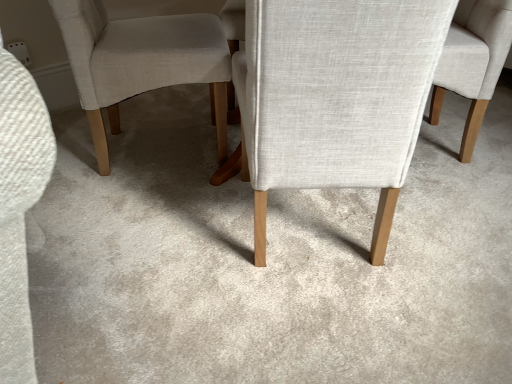
Identify the location of light beige fabric chair at center, which is counted as the 2th chair, starting from the right. This screenshot has width=512, height=384. (336, 96).

What do you see at coordinates (336, 96) in the screenshot?
I see `light beige fabric chair at center, which is counted as the 2th chair, starting from the right` at bounding box center [336, 96].

What do you see at coordinates (473, 62) in the screenshot? I see `light beige fabric chair at center, the first chair viewed from the right` at bounding box center [473, 62].

Identify the location of light beige fabric chair at center, the 2th chair from the left. (473, 62).

You are a GUI agent. You are given a task and a screenshot of the screen. Output one action in this format:
    pyautogui.click(x=<x>, y=<y>)
    Task: Click on the light beige fabric chair at center, positioned as the first chair in left-to-right order
    
    Given the screenshot: What is the action you would take?
    pyautogui.click(x=336, y=96)

Between light beige fabric chair at center, positioned as the first chair in left-to-right order, and light beige fabric chair at center, the first chair viewed from the right, which one appears on the right side from the viewer's perspective?

light beige fabric chair at center, the first chair viewed from the right, is more to the right.

Does light beige fabric chair at center, which is counted as the 2th chair, starting from the right, lie behind light beige fabric chair at center, the 2th chair from the left?

No, light beige fabric chair at center, which is counted as the 2th chair, starting from the right, is closer to the viewer.

Considering the positions of point (301, 82) and point (475, 94), is point (301, 82) closer or farther from the camera than point (475, 94)?

Clearly, point (301, 82) is closer to the camera than point (475, 94).

From the image's perspective, which is below, light beige fabric chair at center, positioned as the first chair in left-to-right order, or light beige fabric chair at center, the 2th chair from the left?

light beige fabric chair at center, positioned as the first chair in left-to-right order, from the image's perspective.

From a real-world perspective, is light beige fabric chair at center, which is counted as the 2th chair, starting from the right, positioned under light beige fabric chair at center, the 2th chair from the left, based on gravity?

Incorrect, from a real-world perspective, light beige fabric chair at center, which is counted as the 2th chair, starting from the right, is higher than light beige fabric chair at center, the 2th chair from the left.

Consider the image. Considering the relative sizes of light beige fabric chair at center, which is counted as the 2th chair, starting from the right, and light beige fabric chair at center, the 2th chair from the left, in the image provided, is light beige fabric chair at center, which is counted as the 2th chair, starting from the right, wider than light beige fabric chair at center, the 2th chair from the left,?

Indeed, light beige fabric chair at center, which is counted as the 2th chair, starting from the right, has a greater width compared to light beige fabric chair at center, the 2th chair from the left.

Considering the sizes of light beige fabric chair at center, which is counted as the 2th chair, starting from the right, and light beige fabric chair at center, the 2th chair from the left, in the image, is light beige fabric chair at center, which is counted as the 2th chair, starting from the right, taller or shorter than light beige fabric chair at center, the 2th chair from the left,?

Considering their sizes, light beige fabric chair at center, which is counted as the 2th chair, starting from the right, has more height than light beige fabric chair at center, the 2th chair from the left.

Between light beige fabric chair at center, which is counted as the 2th chair, starting from the right, and light beige fabric chair at center, the first chair viewed from the right, which one has larger size?

light beige fabric chair at center, which is counted as the 2th chair, starting from the right.

Is light beige fabric chair at center, positioned as the first chair in left-to-right order, inside or outside of light beige fabric chair at center, the first chair viewed from the right?

light beige fabric chair at center, positioned as the first chair in left-to-right order, is outside light beige fabric chair at center, the first chair viewed from the right.

Is light beige fabric chair at center, positioned as the first chair in left-to-right order, next to light beige fabric chair at center, the first chair viewed from the right, and touching it?

light beige fabric chair at center, positioned as the first chair in left-to-right order, and light beige fabric chair at center, the first chair viewed from the right, are clearly separated.

From the picture: Could you tell me if light beige fabric chair at center, positioned as the first chair in left-to-right order, is turned towards light beige fabric chair at center, the 2th chair from the left?

No.

What's the angular difference between light beige fabric chair at center, positioned as the first chair in left-to-right order, and light beige fabric chair at center, the first chair viewed from the right,'s facing directions?

The angle between the facing direction of light beige fabric chair at center, positioned as the first chair in left-to-right order, and the facing direction of light beige fabric chair at center, the first chair viewed from the right, is 91.2 degrees.

Identify the location of chair below the light beige fabric chair at center, the first chair viewed from the right (from the image's perspective). This screenshot has height=384, width=512. (336, 96).

Is light beige fabric chair at center, the first chair viewed from the right, to the right of light beige fabric chair at center, positioned as the first chair in left-to-right order, from the viewer's perspective?

Indeed, light beige fabric chair at center, the first chair viewed from the right, is positioned on the right side of light beige fabric chair at center, positioned as the first chair in left-to-right order.

Is light beige fabric chair at center, the 2th chair from the left, positioned in front of light beige fabric chair at center, positioned as the first chair in left-to-right order?

That is False.

Is point (467, 91) positioned after point (323, 134)?

Yes, it is behind point (323, 134).

From the image's perspective, who appears lower, light beige fabric chair at center, the first chair viewed from the right, or light beige fabric chair at center, which is counted as the 2th chair, starting from the right?

light beige fabric chair at center, which is counted as the 2th chair, starting from the right.

From a real-world perspective, does light beige fabric chair at center, the 2th chair from the left, stand above light beige fabric chair at center, which is counted as the 2th chair, starting from the right?

No.

Considering the relative sizes of light beige fabric chair at center, the first chair viewed from the right, and light beige fabric chair at center, positioned as the first chair in left-to-right order, in the image provided, is light beige fabric chair at center, the first chair viewed from the right, wider than light beige fabric chair at center, positioned as the first chair in left-to-right order,?

In fact, light beige fabric chair at center, the first chair viewed from the right, might be narrower than light beige fabric chair at center, positioned as the first chair in left-to-right order.

Considering the sizes of objects light beige fabric chair at center, the first chair viewed from the right, and light beige fabric chair at center, which is counted as the 2th chair, starting from the right, in the image provided, who is taller, light beige fabric chair at center, the first chair viewed from the right, or light beige fabric chair at center, which is counted as the 2th chair, starting from the right,?

With more height is light beige fabric chair at center, which is counted as the 2th chair, starting from the right.

Does light beige fabric chair at center, the 2th chair from the left, have a larger size compared to light beige fabric chair at center, which is counted as the 2th chair, starting from the right?

No.

Is light beige fabric chair at center, the first chair viewed from the right, completely or partially outside of light beige fabric chair at center, which is counted as the 2th chair, starting from the right?

Indeed, light beige fabric chair at center, the first chair viewed from the right, is completely outside light beige fabric chair at center, which is counted as the 2th chair, starting from the right.

Would you say light beige fabric chair at center, the first chair viewed from the right, is a long distance from light beige fabric chair at center, which is counted as the 2th chair, starting from the right?

They are positioned close to each other.

Could you tell me if light beige fabric chair at center, the 2th chair from the left, is turned towards light beige fabric chair at center, which is counted as the 2th chair, starting from the right?

No.

How many degrees apart are the facing directions of light beige fabric chair at center, the 2th chair from the left, and light beige fabric chair at center, which is counted as the 2th chair, starting from the right?

There is a 91.2-degree angle between the facing directions of light beige fabric chair at center, the 2th chair from the left, and light beige fabric chair at center, which is counted as the 2th chair, starting from the right.

At what (x,y) coordinates should I click in order to perform the action: click on chair on the right of light beige fabric chair at center, positioned as the first chair in left-to-right order. Please return your answer as a coordinate pair (x, y). Image resolution: width=512 pixels, height=384 pixels. Looking at the image, I should click on (473, 62).

This screenshot has height=384, width=512. I want to click on chair behind the light beige fabric chair at center, positioned as the first chair in left-to-right order, so click(473, 62).

Where is `chair below the light beige fabric chair at center, which is counted as the 2th chair, starting from the right (from a real-world perspective)`? chair below the light beige fabric chair at center, which is counted as the 2th chair, starting from the right (from a real-world perspective) is located at coordinates [x=473, y=62].